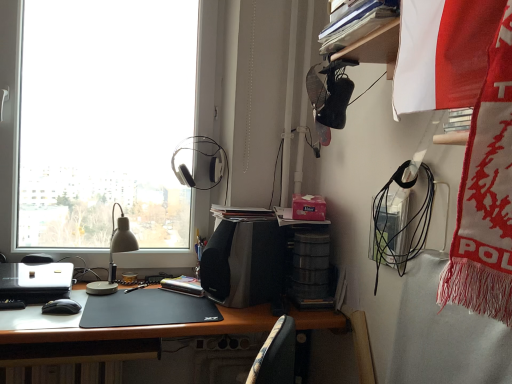
Question: Can you confirm if hardcover book at center is thinner than silver metallic laptop at left?

Choices:
 (A) yes
 (B) no

Answer: (A)

Question: From a real-world perspective, is hardcover book at center below silver metallic laptop at left?

Choices:
 (A) no
 (B) yes

Answer: (A)

Question: From a real-world perspective, is hardcover book at center on top of silver metallic laptop at left?

Choices:
 (A) yes
 (B) no

Answer: (A)

Question: Is hardcover book at center positioned beyond the bounds of silver metallic laptop at left?

Choices:
 (A) no
 (B) yes

Answer: (B)

Question: Is hardcover book at center in front of silver metallic laptop at left?

Choices:
 (A) yes
 (B) no

Answer: (B)

Question: Is black matte desk at center wider or thinner than black matte mouse at lower left?

Choices:
 (A) thin
 (B) wide

Answer: (B)

Question: Looking at the image, does black matte desk at center seem bigger or smaller compared to black matte mouse at lower left?

Choices:
 (A) small
 (B) big

Answer: (B)

Question: From a real-world perspective, relative to black matte mouse at lower left, is black matte desk at center vertically above or below?

Choices:
 (A) below
 (B) above

Answer: (A)

Question: Considering the positions of black matte desk at center and black matte mouse at lower left in the image, is black matte desk at center taller or shorter than black matte mouse at lower left?

Choices:
 (A) tall
 (B) short

Answer: (A)

Question: Considering the positions of transparent glass window at upper left and hardcover book at center in the image, is transparent glass window at upper left taller or shorter than hardcover book at center?

Choices:
 (A) short
 (B) tall

Answer: (B)

Question: Is transparent glass window at upper left in front of or behind hardcover book at center in the image?

Choices:
 (A) behind
 (B) front

Answer: (A)

Question: From a real-world perspective, is transparent glass window at upper left positioned above or below hardcover book at center?

Choices:
 (A) above
 (B) below

Answer: (A)

Question: Is transparent glass window at upper left wider or thinner than hardcover book at center?

Choices:
 (A) thin
 (B) wide

Answer: (A)

Question: From a real-world perspective, is velvet-like fabric chair at lower center positioned above or below hardcover book at center?

Choices:
 (A) below
 (B) above

Answer: (A)

Question: From the image's perspective, is velvet-like fabric chair at lower center positioned above or below hardcover book at center?

Choices:
 (A) below
 (B) above

Answer: (A)